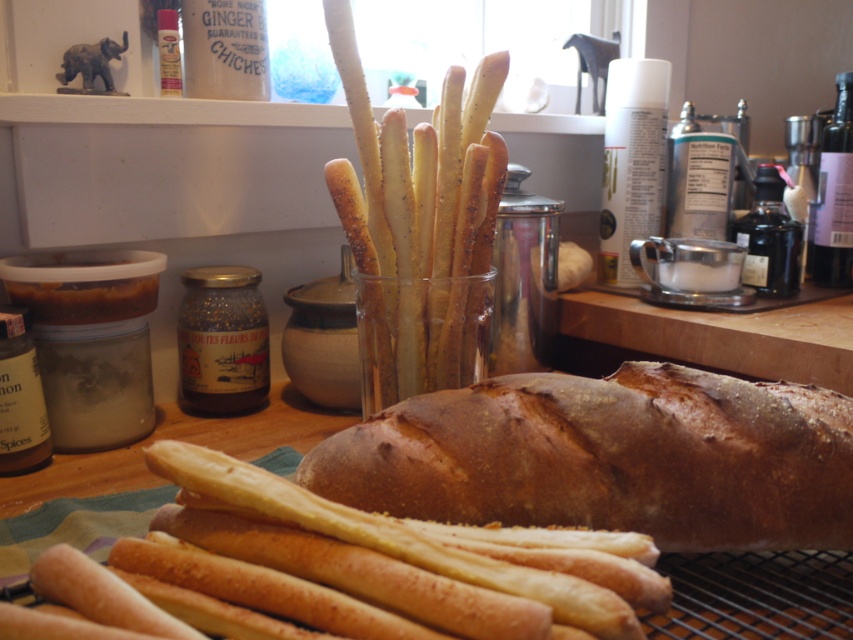
You are a baker who wants to stack the brown matte bread at center and golden breadsticks at center vertically on a shelf. Which one should be placed at the bottom to ensure stability?

The brown matte bread at center has a greater height compared to golden breadsticks at center, so placing it at the bottom would provide a stable base for the stack.